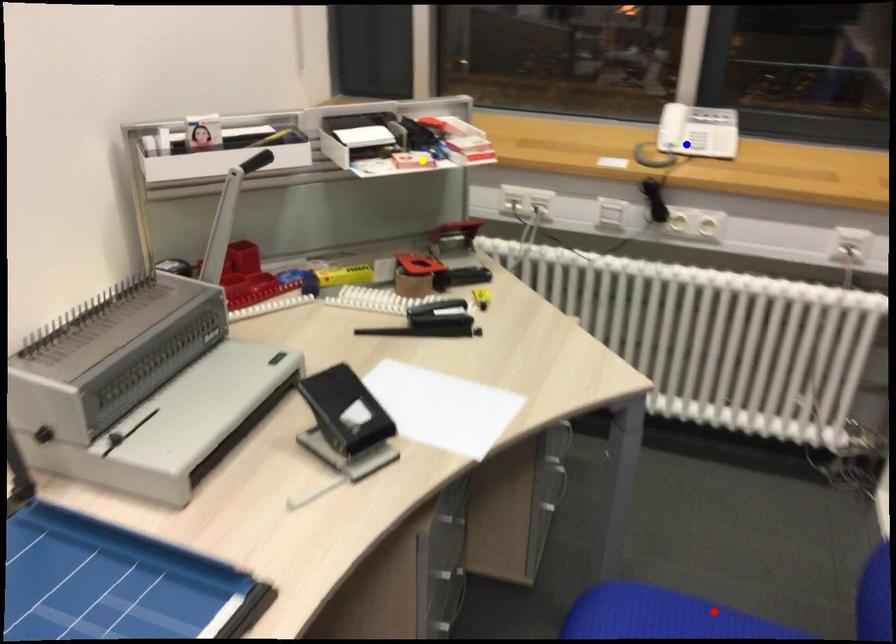
Order these from nearest to farthest:
1. red point
2. yellow point
3. blue point

red point
yellow point
blue point